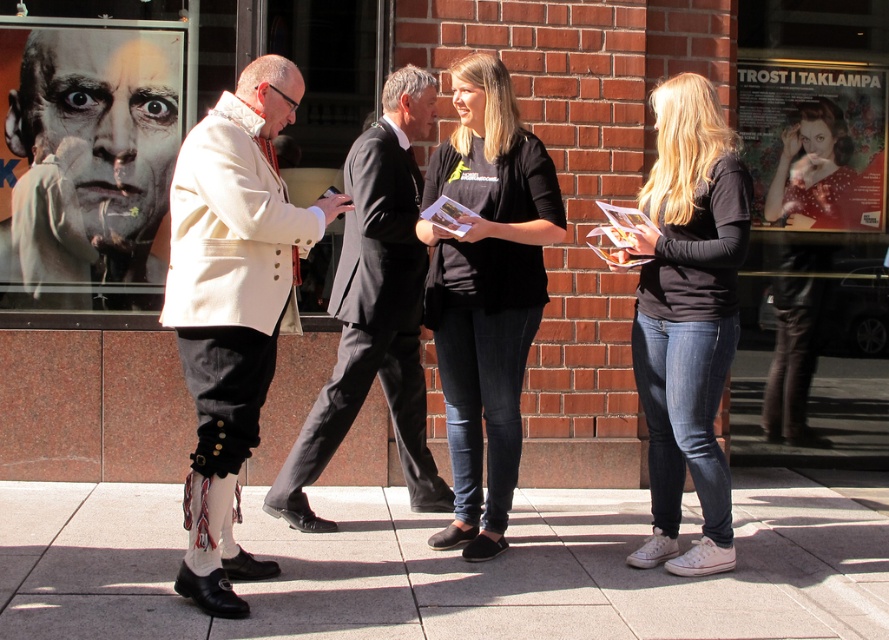
Question: Among these points, which one is nearest to the camera?

Choices:
 (A) (407, 125)
 (B) (799, 141)
 (C) (482, 148)

Answer: (C)

Question: Can you confirm if white textured coat at center is positioned to the right of matte red poster at upper right?

Choices:
 (A) yes
 (B) no

Answer: (B)

Question: Does matte black coat at center have a lesser width compared to matte red poster at upper right?

Choices:
 (A) yes
 (B) no

Answer: (A)

Question: Which point is farther to the camera?

Choices:
 (A) matte black coat at center
 (B) matte red poster at upper right
 (C) black cotton t-shirt at center

Answer: (B)

Question: Which point is farther to the camera?

Choices:
 (A) (401, 408)
 (B) (765, 394)
 (C) (873, 84)
 (D) (495, 538)

Answer: (B)

Question: Does white leather coat at center have a lesser width compared to white textured coat at center?

Choices:
 (A) yes
 (B) no

Answer: (A)